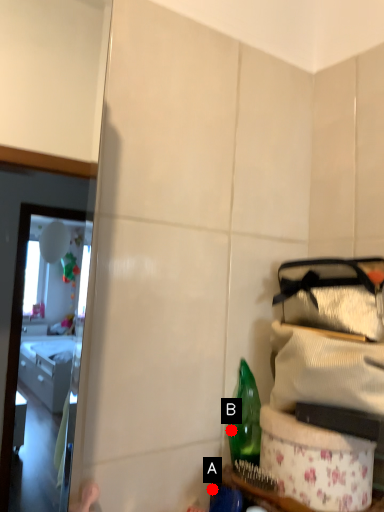
Question: Two points are circled on the image, labeled by A and B beside each circle. Which point is closer to the camera?

Choices:
 (A) A is closer
 (B) B is closer

Answer: (A)